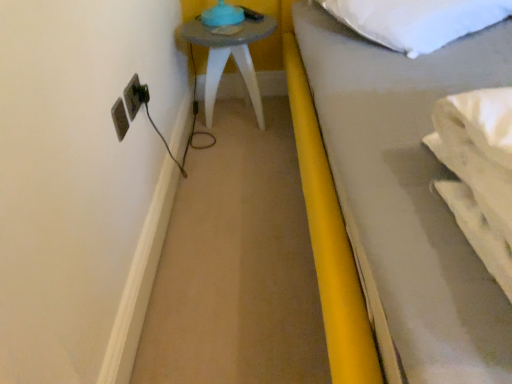
Question: Is matte gray side table at upper left positioned in front of matte plastic electrical outlet at left?

Choices:
 (A) yes
 (B) no

Answer: (B)

Question: Considering the relative positions of matte gray side table at upper left and matte plastic electrical outlet at left in the image provided, is matte gray side table at upper left to the left of matte plastic electrical outlet at left from the viewer's perspective?

Choices:
 (A) yes
 (B) no

Answer: (B)

Question: Is matte gray side table at upper left facing away from matte plastic electrical outlet at left?

Choices:
 (A) no
 (B) yes

Answer: (A)

Question: From the image's perspective, would you say matte gray side table at upper left is shown under matte plastic electrical outlet at left?

Choices:
 (A) no
 (B) yes

Answer: (A)

Question: Is matte gray side table at upper left in contact with matte plastic electrical outlet at left?

Choices:
 (A) no
 (B) yes

Answer: (A)

Question: Considering the positions of matte plastic electrical outlet at left and matte gray side table at upper left in the image, is matte plastic electrical outlet at left taller or shorter than matte gray side table at upper left?

Choices:
 (A) short
 (B) tall

Answer: (A)

Question: Is matte plastic electrical outlet at left inside the boundaries of matte gray side table at upper left, or outside?

Choices:
 (A) outside
 (B) inside

Answer: (A)

Question: In the image, is matte plastic electrical outlet at left positioned in front of or behind matte gray side table at upper left?

Choices:
 (A) behind
 (B) front

Answer: (B)

Question: Looking at their shapes, would you say matte plastic electrical outlet at left is wider or thinner than matte gray side table at upper left?

Choices:
 (A) thin
 (B) wide

Answer: (A)

Question: Considering the positions of white soft pillow at upper right and matte plastic electrical outlet at left in the image, is white soft pillow at upper right wider or thinner than matte plastic electrical outlet at left?

Choices:
 (A) thin
 (B) wide

Answer: (B)

Question: Based on their positions, is white soft pillow at upper right located to the left or right of matte plastic electrical outlet at left?

Choices:
 (A) left
 (B) right

Answer: (B)

Question: From the image's perspective, is white soft pillow at upper right above or below matte plastic electrical outlet at left?

Choices:
 (A) above
 (B) below

Answer: (A)

Question: Is point (415, 46) closer or farther from the camera than point (129, 97)?

Choices:
 (A) closer
 (B) farther

Answer: (B)

Question: Visually, is white soft pillow at upper right positioned to the left or to the right of matte gray side table at upper left?

Choices:
 (A) right
 (B) left

Answer: (A)

Question: Relative to matte gray side table at upper left, is white soft pillow at upper right in front or behind?

Choices:
 (A) front
 (B) behind

Answer: (A)